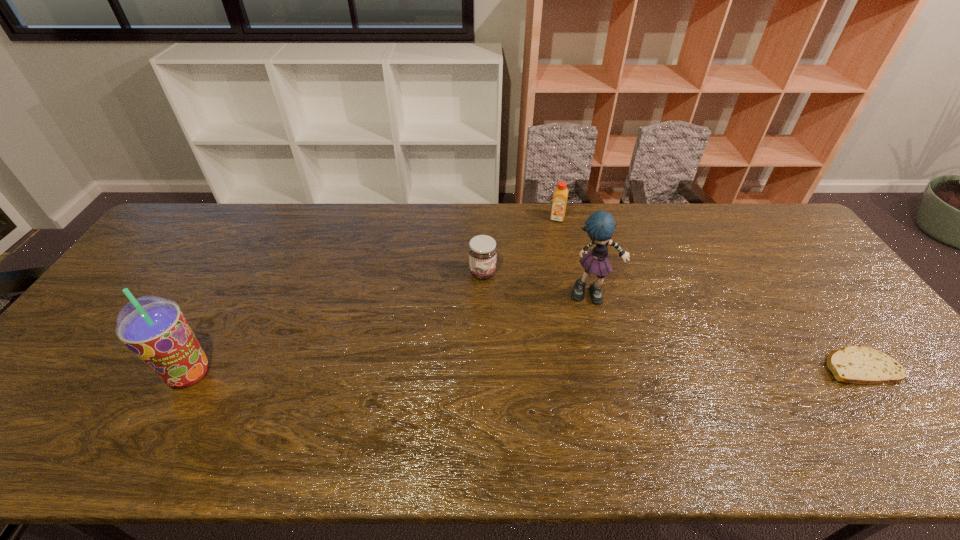
At what (x,y) coordinates should I click in order to perform the action: click on the leftmost object. Please return your answer as a coordinate pair (x, y). This screenshot has width=960, height=540. Looking at the image, I should click on (153, 328).

The height and width of the screenshot is (540, 960). I want to click on pita bread, so click(x=853, y=364).

I want to click on the rightmost object, so click(853, 364).

The height and width of the screenshot is (540, 960). Find the location of `the second shortest object`. the second shortest object is located at coordinates (482, 250).

Where is `the second farthest object`? The width and height of the screenshot is (960, 540). the second farthest object is located at coordinates coord(482,250).

Locate an element on the screen. the third tallest object is located at coordinates (560, 195).

In order to click on orange juice in this screenshot , I will do 560,195.

The image size is (960, 540). Find the location of `rag doll`. rag doll is located at coordinates (600, 226).

What are the coordinates of `free point located on the left of the leftmost object` in the screenshot? It's located at (71, 374).

The height and width of the screenshot is (540, 960). Identify the location of vacant space located on the left of the rightmost object. (751, 366).